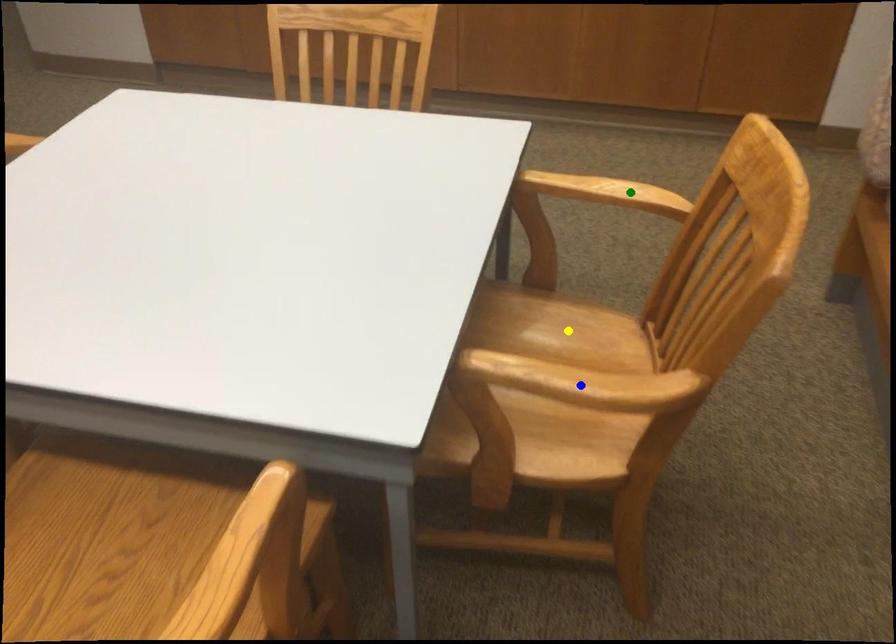
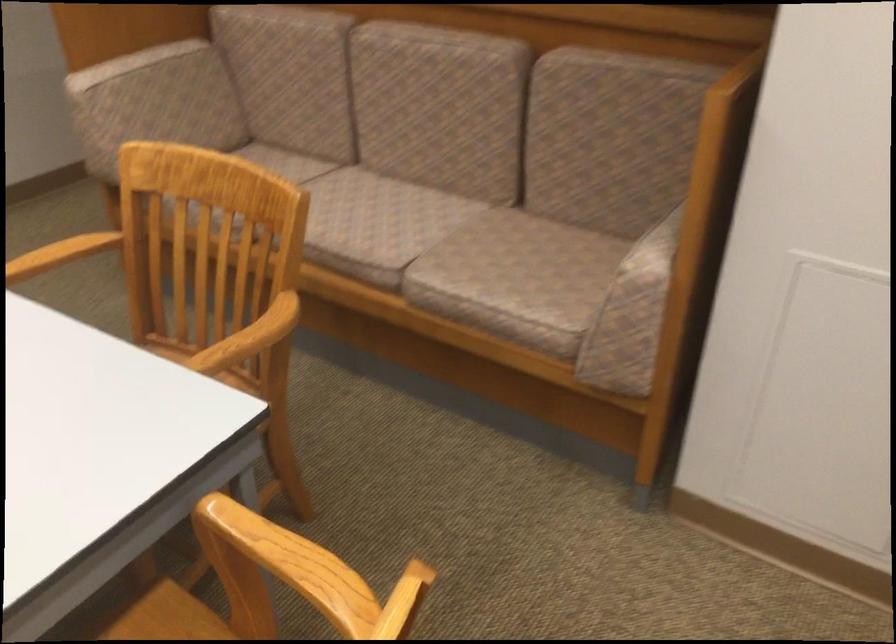
I am providing you with two images of the same scene from different viewpoints. Three points are marked in image1. Which point corresponds to a part or object that is occluded in image2?In image1, three points are marked. Which of them correspond to a part or object that is occluded in image2?Among the three points shown in image1, which one corresponds to a part or object that is no longer visible due to occlusion in image2?

yellow point cannot be seen in image2.